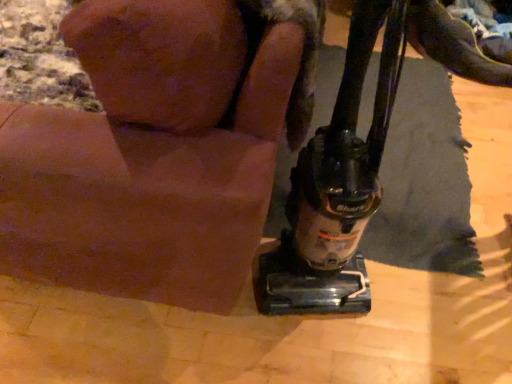
Where is `black plastic vacuum cleaner at lower right`? The height and width of the screenshot is (384, 512). black plastic vacuum cleaner at lower right is located at coordinates (337, 184).

The image size is (512, 384). In order to click on furry brown dog at lower right in this screenshot , I will do click(x=150, y=155).

Is black plastic vacuum cleaner at lower right far from black leather shoe at upper right?

Yes, black plastic vacuum cleaner at lower right and black leather shoe at upper right are quite far apart.

Where is `footwear located behind the black plastic vacuum cleaner at lower right`? footwear located behind the black plastic vacuum cleaner at lower right is located at coordinates (453, 44).

Between black plastic vacuum cleaner at lower right and black leather shoe at upper right, which one is positioned in front?

black plastic vacuum cleaner at lower right is more forward.

Consider the image. From a real-world perspective, which object stands above the other?

In real-world perspective, black plastic vacuum cleaner at lower right is above.

Between black leather shoe at upper right and furry brown dog at lower right, which one appears on the left side from the viewer's perspective?

Positioned to the left is furry brown dog at lower right.

Is black leather shoe at upper right not near furry brown dog at lower right?

Absolutely, black leather shoe at upper right is distant from furry brown dog at lower right.

Is black leather shoe at upper right oriented away from furry brown dog at lower right?

black leather shoe at upper right is not turned away from furry brown dog at lower right.

Would you say black leather shoe at upper right is inside or outside furry brown dog at lower right?

black leather shoe at upper right is located beyond the bounds of furry brown dog at lower right.

Looking at this image, which of these two, furry brown dog at lower right or black plastic vacuum cleaner at lower right, is bigger?

Bigger between the two is furry brown dog at lower right.

From the image's perspective, which is above, furry brown dog at lower right or black plastic vacuum cleaner at lower right?

furry brown dog at lower right appears higher in the image.

Which is in front, furry brown dog at lower right or black plastic vacuum cleaner at lower right?

furry brown dog at lower right.

Would you say furry brown dog at lower right contains black plastic vacuum cleaner at lower right?

Absolutely, black plastic vacuum cleaner at lower right is inside furry brown dog at lower right.

Looking at this image, can you tell me how much black plastic vacuum cleaner at lower right and furry brown dog at lower right differ in facing direction?

There is a 103-degree angle between the facing directions of black plastic vacuum cleaner at lower right and furry brown dog at lower right.

Considering the relative sizes of black plastic vacuum cleaner at lower right and furry brown dog at lower right in the image provided, is black plastic vacuum cleaner at lower right wider than furry brown dog at lower right?

In fact, black plastic vacuum cleaner at lower right might be narrower than furry brown dog at lower right.

From the image's perspective, relative to furry brown dog at lower right, is black plastic vacuum cleaner at lower right above or below?

black plastic vacuum cleaner at lower right is below furry brown dog at lower right.

Is furry brown dog at lower right facing towards black leather shoe at upper right?

No, furry brown dog at lower right is not oriented towards black leather shoe at upper right.

Consider the image. Are furry brown dog at lower right and black leather shoe at upper right making contact?

No, furry brown dog at lower right is not with black leather shoe at upper right.

Can you confirm if furry brown dog at lower right is bigger than black leather shoe at upper right?

Yes, furry brown dog at lower right is bigger than black leather shoe at upper right.

Is furry brown dog at lower right behind black leather shoe at upper right?

No, the depth of furry brown dog at lower right is less than that of black leather shoe at upper right.

Can you confirm if black leather shoe at upper right is positioned to the left of black plastic vacuum cleaner at lower right?

No.

Is black leather shoe at upper right aimed at black plastic vacuum cleaner at lower right?

Yes, black leather shoe at upper right is aimed at black plastic vacuum cleaner at lower right.

In the scene shown: Which object is further away from the camera, black leather shoe at upper right or black plastic vacuum cleaner at lower right?

Positioned behind is black leather shoe at upper right.

Which is more distant, (413, 42) or (302, 208)?

Positioned behind is point (413, 42).

Identify the location of sewing machine that is in front of the black leather shoe at upper right. (337, 184).

At what (x,y) coordinates should I click in order to perform the action: click on animal above the black leather shoe at upper right (from a real-world perspective). Please return your answer as a coordinate pair (x, y). This screenshot has height=384, width=512. Looking at the image, I should click on [150, 155].

Based on their spatial positions, is black leather shoe at upper right or black plastic vacuum cleaner at lower right closer to furry brown dog at lower right?

The object closer to furry brown dog at lower right is black plastic vacuum cleaner at lower right.

Based on the photo, from the image, which object appears to be farther from black leather shoe at upper right, black plastic vacuum cleaner at lower right or furry brown dog at lower right?

Among the two, furry brown dog at lower right is located further to black leather shoe at upper right.

Estimate the real-world distances between objects in this image. Which object is closer to black leather shoe at upper right, furry brown dog at lower right or black plastic vacuum cleaner at lower right?

The object closer to black leather shoe at upper right is black plastic vacuum cleaner at lower right.

Which object lies nearer to the anchor point furry brown dog at lower right, black plastic vacuum cleaner at lower right or black leather shoe at upper right?

black plastic vacuum cleaner at lower right is closer to furry brown dog at lower right.

Based on their spatial positions, is furry brown dog at lower right or black leather shoe at upper right further from black plastic vacuum cleaner at lower right?

black leather shoe at upper right lies further to black plastic vacuum cleaner at lower right than the other object.

Based on their spatial positions, is black leather shoe at upper right or furry brown dog at lower right closer to black plastic vacuum cleaner at lower right?

Based on the image, furry brown dog at lower right appears to be nearer to black plastic vacuum cleaner at lower right.

The height and width of the screenshot is (384, 512). I want to click on sewing machine between furry brown dog at lower right and black leather shoe at upper right from front to back, so click(337, 184).